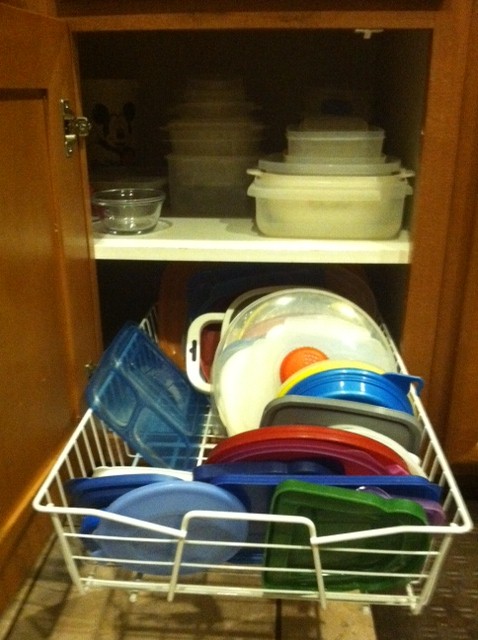
The height and width of the screenshot is (640, 478). In order to click on door in this screenshot , I will do `click(44, 422)`, `click(450, 308)`.